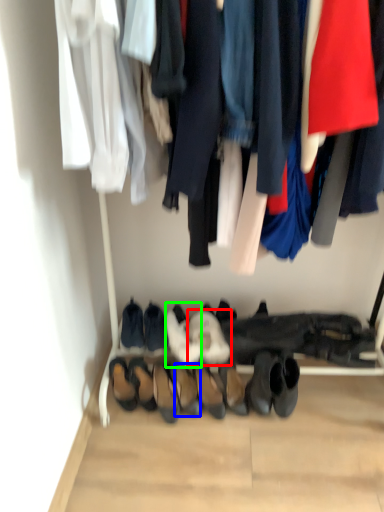
Question: Based on their relative distances, which object is nearer to footwear (highlighted by a red box)? Choose from footwear (highlighted by a blue box) and footwear (highlighted by a green box).

Choices:
 (A) footwear
 (B) footwear

Answer: (B)